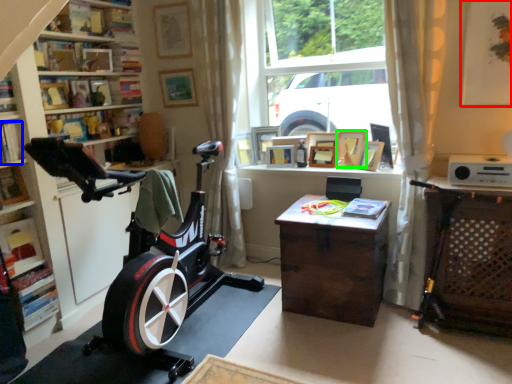
Question: Based on their relative distances, which object is farther from picture frame (highlighted by a red box)? Choose from book (highlighted by a blue box) and picture frame (highlighted by a green box).

Choices:
 (A) book
 (B) picture frame

Answer: (A)